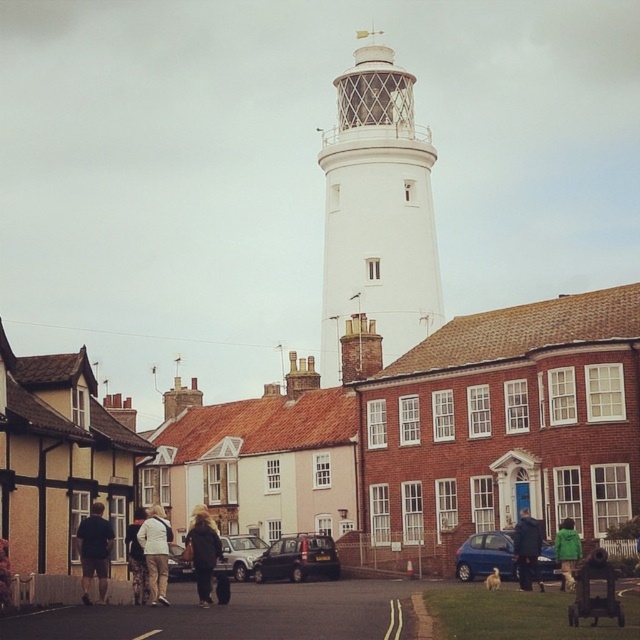
Which is above, white matte lighthouse at center or light brown leather jacket at center?

white matte lighthouse at center

From the picture: Is white matte lighthouse at center positioned behind light brown leather jacket at center?

Yes, it is behind light brown leather jacket at center.

Who is more forward, [342,262] or [136,579]?

Positioned in front is point [136,579].

Locate an element on the screen. white matte lighthouse at center is located at coordinates (378, 212).

Who is more forward, [291,536] or [573,531]?

Positioned in front is point [573,531].

Does dark gray metallic hatchback at center appear under green matte jacket at lower right?

Correct, dark gray metallic hatchback at center is located below green matte jacket at lower right.

Is point (330, 550) more distant than point (573, 534)?

Yes.

I want to click on dark gray metallic hatchback at center, so click(298, 557).

Is point (336, 346) closer to camera compared to point (202, 536)?

No, it is behind (202, 536).

Who is more forward, (408, 100) or (218, 554)?

Point (218, 554) is more forward.

Is point (368, 292) closer to viewer compared to point (204, 563)?

No, it is not.

I want to click on white matte lighthouse at center, so click(x=378, y=212).